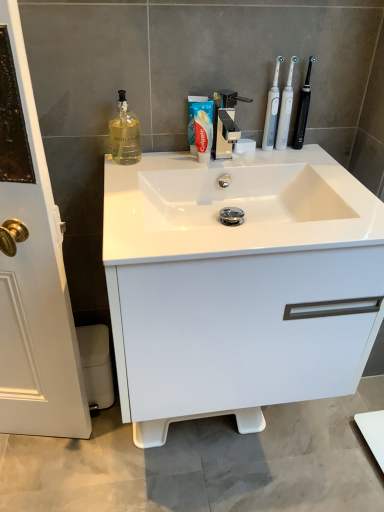
The width and height of the screenshot is (384, 512). What do you see at coordinates (236, 284) in the screenshot?
I see `white glossy cabinet at center` at bounding box center [236, 284].

Where is `white plastic toothbrush at upper center, which is the third toothbrush in right-to-left order`? The image size is (384, 512). white plastic toothbrush at upper center, which is the third toothbrush in right-to-left order is located at coordinates (272, 110).

Identify the location of white glossy sink at center. (234, 205).

The image size is (384, 512). Find the location of `white matte toothpaste at center`. white matte toothpaste at center is located at coordinates (203, 129).

Where is `white plastic toothbrush at upper right, the second toothbrush viewed from the left`? white plastic toothbrush at upper right, the second toothbrush viewed from the left is located at coordinates (285, 110).

Where is `white glossy cabinet at center`? This screenshot has height=512, width=384. white glossy cabinet at center is located at coordinates [x=236, y=284].

From a real-world perspective, which object rests below the other?

white plastic toothbrush at upper center, the first toothbrush in the left-to-right sequence, is physically lower.

Is white plastic toothbrush at upper right, the second toothbrush viewed from the right, in front of or behind white plastic toothbrush at upper center, the first toothbrush in the left-to-right sequence, in the image?

Visually, white plastic toothbrush at upper right, the second toothbrush viewed from the right, is located behind white plastic toothbrush at upper center, the first toothbrush in the left-to-right sequence.

Which of these two, white plastic toothbrush at upper right, the second toothbrush viewed from the right, or white plastic toothbrush at upper center, which is the third toothbrush in right-to-left order, is thinner?

Thinner between the two is white plastic toothbrush at upper center, which is the third toothbrush in right-to-left order.

Would you say white plastic toothbrush at upper right, the second toothbrush viewed from the left, is part of black plastic toothbrush at upper right, positioned as the first toothbrush in right-to-left order,'s contents?

Definitely not — white plastic toothbrush at upper right, the second toothbrush viewed from the left, is not inside black plastic toothbrush at upper right, positioned as the first toothbrush in right-to-left order.

From the black plastic toothbrush at upper right, positioned as the first toothbrush in right-to-left order, count the 1st toothbrush to the left and point to it. Please provide its 2D coordinates.

[(285, 110)]

Is black plastic toothbrush at upper right, the third toothbrush in the left-to-right sequence, positioned with its back to white plastic toothbrush at upper right, the second toothbrush viewed from the right?

No.

Is black plastic toothbrush at upper right, the third toothbrush in the left-to-right sequence, closer to the viewer compared to white plastic toothbrush at upper right, the second toothbrush viewed from the left?

No.

From a real-world perspective, which is physically below, white glossy sink at center or black plastic toothbrush at upper right, positioned as the first toothbrush in right-to-left order?

In real-world perspective, white glossy sink at center is lower.

Would you consider white glossy sink at center to be distant from black plastic toothbrush at upper right, the third toothbrush in the left-to-right sequence?

That's not correct — white glossy sink at center is a little close to black plastic toothbrush at upper right, the third toothbrush in the left-to-right sequence.

What's the angular difference between white glossy sink at center and black plastic toothbrush at upper right, the third toothbrush in the left-to-right sequence,'s facing directions?

The facing directions of white glossy sink at center and black plastic toothbrush at upper right, the third toothbrush in the left-to-right sequence, are 1.31 degrees apart.

What's the angular difference between white glossy cabinet at center and white plastic toothbrush at upper right, the second toothbrush viewed from the right,'s facing directions?

They differ by 1.32 degrees in their facing directions.

Looking at this image, considering the relative sizes of white glossy cabinet at center and white plastic toothbrush at upper right, the second toothbrush viewed from the left, in the image provided, is white glossy cabinet at center shorter than white plastic toothbrush at upper right, the second toothbrush viewed from the left,?

No.

Would you say white glossy cabinet at center is to the left or to the right of white plastic toothbrush at upper right, the second toothbrush viewed from the right, in the picture?

white glossy cabinet at center is positioned on white plastic toothbrush at upper right, the second toothbrush viewed from the right,'s left side.

Which object is thinner, white glossy cabinet at center or white plastic toothbrush at upper right, the second toothbrush viewed from the left?

With smaller width is white plastic toothbrush at upper right, the second toothbrush viewed from the left.

From a real-world perspective, is black plastic toothbrush at upper right, positioned as the first toothbrush in right-to-left order, on top of white matte toothpaste at center?

Yes, from a real-world perspective, black plastic toothbrush at upper right, positioned as the first toothbrush in right-to-left order, is over white matte toothpaste at center

Are black plastic toothbrush at upper right, the third toothbrush in the left-to-right sequence, and white matte toothpaste at center located far from each other?

No, black plastic toothbrush at upper right, the third toothbrush in the left-to-right sequence, is not far from white matte toothpaste at center.

Considering the relative sizes of black plastic toothbrush at upper right, positioned as the first toothbrush in right-to-left order, and white matte toothpaste at center in the image provided, is black plastic toothbrush at upper right, positioned as the first toothbrush in right-to-left order, shorter than white matte toothpaste at center?

In fact, black plastic toothbrush at upper right, positioned as the first toothbrush in right-to-left order, may be taller than white matte toothpaste at center.

Does black plastic toothbrush at upper right, the third toothbrush in the left-to-right sequence, come in front of white matte toothpaste at center?

No, the depth of black plastic toothbrush at upper right, the third toothbrush in the left-to-right sequence, is greater than that of white matte toothpaste at center.

Considering the relative sizes of black plastic toothbrush at upper right, the third toothbrush in the left-to-right sequence, and white glossy cabinet at center in the image provided, is black plastic toothbrush at upper right, the third toothbrush in the left-to-right sequence, taller than white glossy cabinet at center?

Incorrect, the height of black plastic toothbrush at upper right, the third toothbrush in the left-to-right sequence, is not larger of that of white glossy cabinet at center.

Starting from the white glossy cabinet at center, which toothbrush is the 3rd one to the right? Please provide its 2D coordinates.

[(303, 109)]

Measure the distance between black plastic toothbrush at upper right, the third toothbrush in the left-to-right sequence, and white glossy cabinet at center.

The distance of black plastic toothbrush at upper right, the third toothbrush in the left-to-right sequence, from white glossy cabinet at center is 49.84 centimeters.

Is black plastic toothbrush at upper right, the third toothbrush in the left-to-right sequence, in front of or behind white glossy cabinet at center in the image?

In the image, black plastic toothbrush at upper right, the third toothbrush in the left-to-right sequence, appears behind white glossy cabinet at center.

Is black plastic toothbrush at upper right, positioned as the first toothbrush in right-to-left order, not close to white glossy sink at center?

No, black plastic toothbrush at upper right, positioned as the first toothbrush in right-to-left order, is not far from white glossy sink at center.

Is point (307, 108) positioned before point (140, 251)?

No.

Between black plastic toothbrush at upper right, positioned as the first toothbrush in right-to-left order, and white glossy sink at center, which one appears on the left side from the viewer's perspective?

white glossy sink at center is more to the left.

Where is `the 1st toothbrush to the right when counting from the white plastic toothbrush at upper center, which is the third toothbrush in right-to-left order`? the 1st toothbrush to the right when counting from the white plastic toothbrush at upper center, which is the third toothbrush in right-to-left order is located at coordinates (285, 110).

Where is `the 1st toothbrush below when counting from the black plastic toothbrush at upper right, positioned as the first toothbrush in right-to-left order (from the image's perspective)`? The width and height of the screenshot is (384, 512). the 1st toothbrush below when counting from the black plastic toothbrush at upper right, positioned as the first toothbrush in right-to-left order (from the image's perspective) is located at coordinates (285, 110).

Considering their positions, is white glossy sink at center positioned closer to white glossy cabinet at center than translucent glass bottle at upper left?

Among the two, white glossy sink at center is located nearer to white glossy cabinet at center.

Which object lies further to the anchor point white matte toothpaste at center, white glossy cabinet at center or translucent glass bottle at upper left?

Based on the image, white glossy cabinet at center appears to be further to white matte toothpaste at center.

From the image, which object appears to be farther from white glossy sink at center, translucent glass bottle at upper left or white matte toothpaste at center?

The object further to white glossy sink at center is translucent glass bottle at upper left.

Based on their spatial positions, is white matte toothpaste at center or translucent glass bottle at upper left closer to white plastic toothbrush at upper right, the second toothbrush viewed from the left?

Among the two, white matte toothpaste at center is located nearer to white plastic toothbrush at upper right, the second toothbrush viewed from the left.

Considering their positions, is white glossy sink at center positioned closer to white glossy cabinet at center than white matte toothpaste at center?

white glossy sink at center lies closer to white glossy cabinet at center than the other object.

Which object lies further to the anchor point white matte toothpaste at center, translucent glass bottle at upper left or white plastic toothbrush at upper center, the first toothbrush in the left-to-right sequence?

white plastic toothbrush at upper center, the first toothbrush in the left-to-right sequence.

Looking at the image, which one is located closer to black plastic toothbrush at upper right, positioned as the first toothbrush in right-to-left order, white glossy sink at center or white glossy cabinet at center?

white glossy sink at center lies closer to black plastic toothbrush at upper right, positioned as the first toothbrush in right-to-left order, than the other object.

Considering their positions, is translucent glass bottle at upper left positioned closer to white glossy sink at center than white plastic toothbrush at upper right, the second toothbrush viewed from the left?

Among the two, translucent glass bottle at upper left is located nearer to white glossy sink at center.

Identify the location of shaving cream between white plastic toothbrush at upper center, which is the third toothbrush in right-to-left order, and white glossy cabinet at center from top to bottom. The width and height of the screenshot is (384, 512). (203, 129).

Locate an element on the screen. shaving cream between translucent glass bottle at upper left and white plastic toothbrush at upper right, the second toothbrush viewed from the right, from left to right is located at coordinates (203, 129).

Find the location of a particular element. sink between white plastic toothbrush at upper center, the first toothbrush in the left-to-right sequence, and white glossy cabinet at center, in the vertical direction is located at coordinates (234, 205).

What are the coordinates of `sink between translucent glass bottle at upper left and white plastic toothbrush at upper center, the first toothbrush in the left-to-right sequence, from left to right` in the screenshot? It's located at (234, 205).